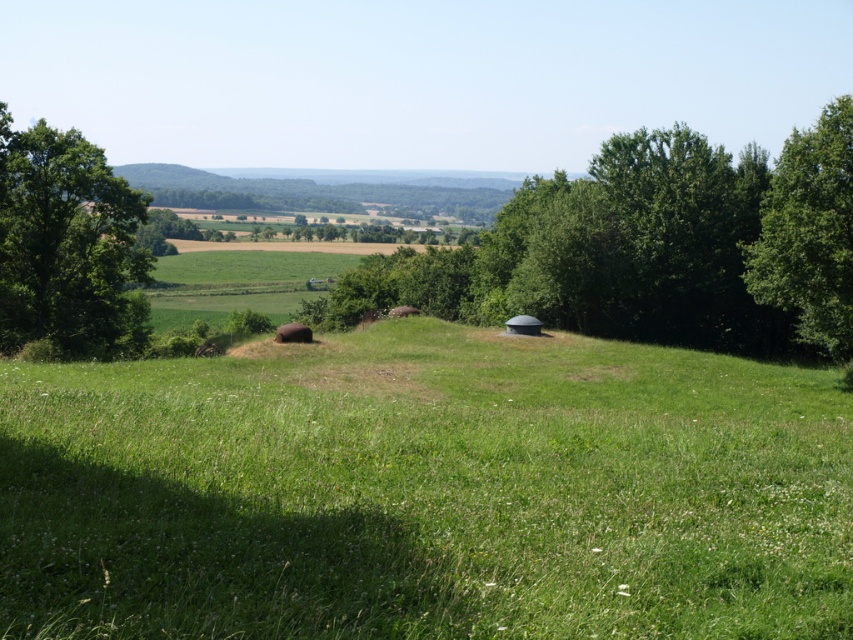
Is green grass at center smaller than green leafy tree at center?

Correct, green grass at center occupies less space than green leafy tree at center.

Can you confirm if green grass at center is positioned above green leafy tree at center?

No, green grass at center is not above green leafy tree at center.

The width and height of the screenshot is (853, 640). I want to click on green grass at center, so click(x=425, y=492).

Measure the distance between green leafy tree at center and green leafy tree at right.

green leafy tree at center and green leafy tree at right are 70.05 feet apart from each other.

Is green leafy tree at center below green leafy tree at right?

Yes.

Which is behind, point (683, 284) or point (846, 150)?

Point (683, 284)

Locate an element on the screen. Image resolution: width=853 pixels, height=640 pixels. green leafy tree at center is located at coordinates (654, 248).

Where is `green grass at center`? green grass at center is located at coordinates (425, 492).

Can you confirm if green grass at center is positioned to the left of green leafy tree at left?

No, green grass at center is not to the left of green leafy tree at left.

You are a GUI agent. You are given a task and a screenshot of the screen. Output one action in this format:
    pyautogui.click(x=<x>, y=<y>)
    Task: Click on the green grass at center
    The height and width of the screenshot is (640, 853).
    Given the screenshot: What is the action you would take?
    pyautogui.click(x=425, y=492)